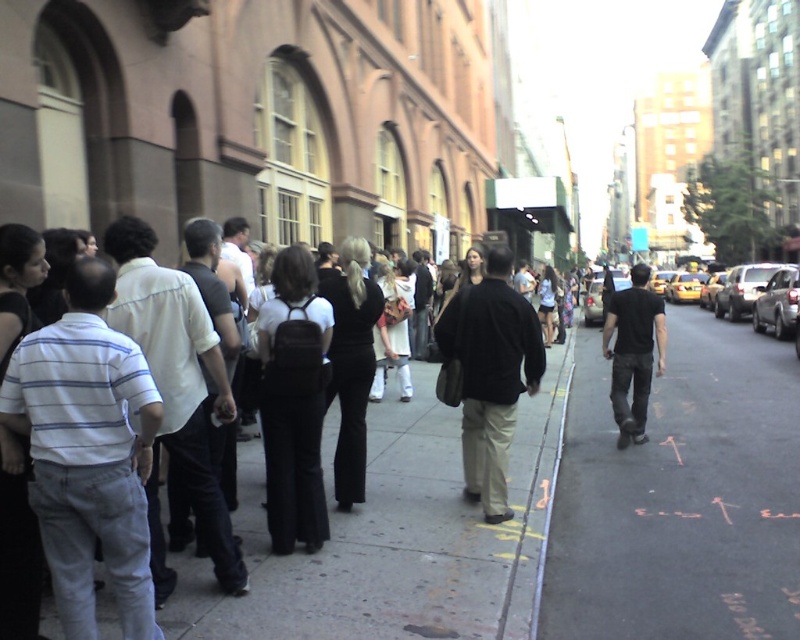
Does black matte pants at center have a smaller size compared to silver metallic sedan at right?

Correct, black matte pants at center occupies less space than silver metallic sedan at right.

Based on the photo, does black matte pants at center appear on the left side of silver metallic sedan at right?

Yes, black matte pants at center is to the left of silver metallic sedan at right.

Is point (438, 445) closer to camera compared to point (758, 294)?

Yes, it is.

At what (x,y) coordinates should I click in order to perform the action: click on black matte pants at center. Please return your answer as a coordinate pair (x, y). This screenshot has height=640, width=800. Looking at the image, I should click on (396, 538).

Between point (608, 580) and point (725, 312), which one is positioned behind?

The point (725, 312) is behind.

Does point (620, 516) come farther from viewer compared to point (730, 291)?

No, (620, 516) is closer to viewer.

Describe the element at coordinates (680, 496) in the screenshot. This screenshot has height=640, width=800. I see `black asphalt at center` at that location.

This screenshot has height=640, width=800. Identify the location of black asphalt at center. (680, 496).

Can you confirm if metallic silver sedan at right is thinner than silver metallic sedan at right?

Yes, metallic silver sedan at right is thinner than silver metallic sedan at right.

Between point (786, 289) and point (754, 266), which one is positioned in front?

Point (786, 289) is in front.

Identify the location of metallic silver sedan at right. (776, 301).